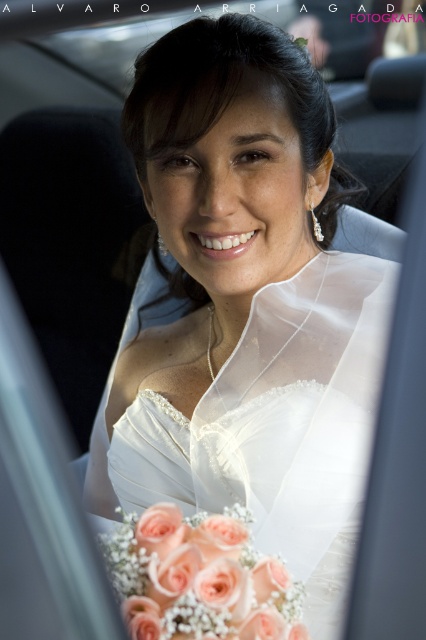
You are a photographer adjusting the camera focus. You need to focus on both the point at point (x=342, y=548) and point (x=247, y=627). Which point should you focus on first to ensure the subject in the foreground is sharp?

Point (x=247, y=627) should be focused first since it is in the foreground and point 0.858, 0.802 is behind it.

You are a photographer adjusting the lighting for a wedding photo shoot. You need to ensure both the white satin wedding dress at center and the peachy silk bouquet at center are well lit. Since the dress is on one side, where should you place the main light to evenly illuminate both objects?

The white satin wedding dress at center is positioned on the right side of peachy silk bouquet at center. To evenly illuminate both, place the main light to the left of the bouquet so that it reaches both the bouquet and the dress on its right side.

You are a photographer trying to capture a close shot of the bride in the car. The white satin wedding dress at center and the peachy silk bouquet at center are both in focus. Which object takes up more space in the photo?

The white satin wedding dress at center takes up more space in the photo because it is wider than the peachy silk bouquet at center.